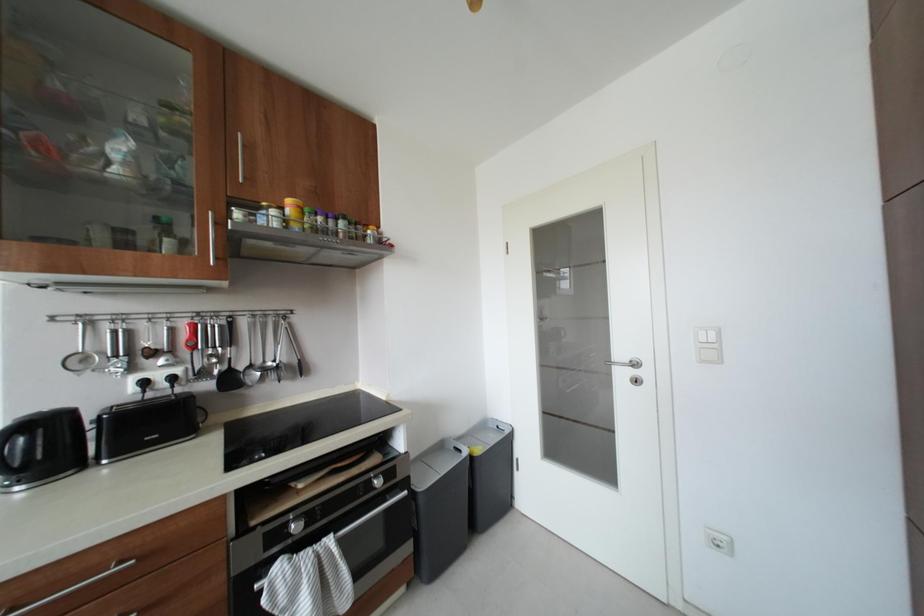
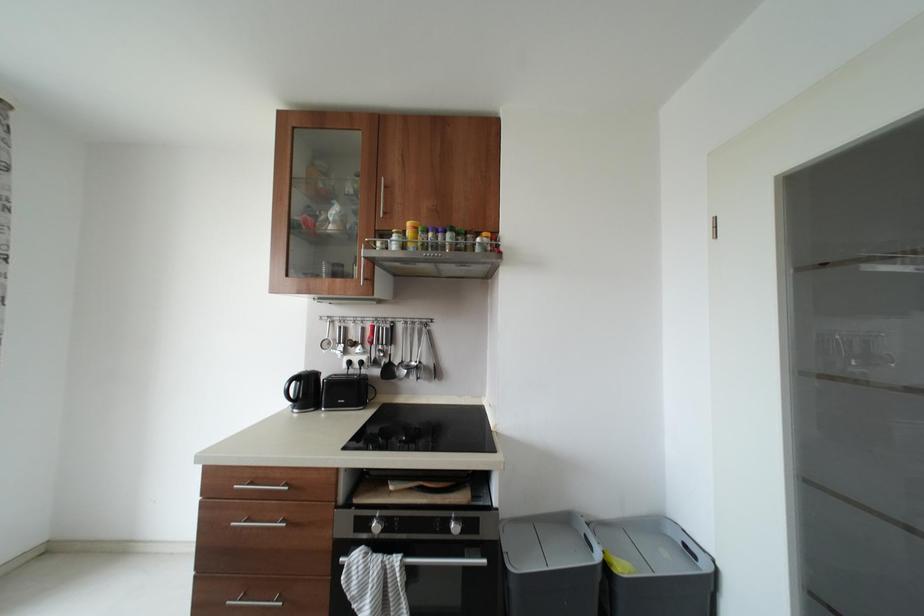
Question: The camera is either moving clockwise (left) or counter-clockwise (right) around the object. The first image is from the beginning of the video and the second image is from the end. Is the camera moving left or right when shooting the video?

Choices:
 (A) Left
 (B) Right

Answer: (B)